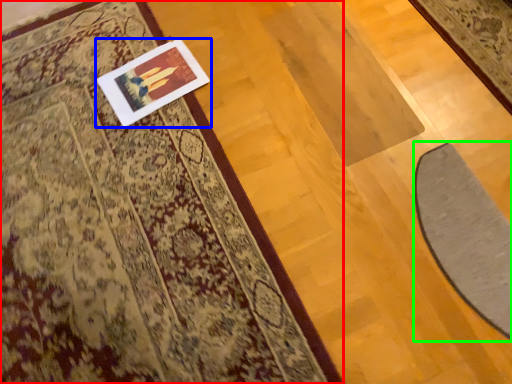
Question: Estimate the real-world distances between objects in this image. Which object is farther from mat (highlighted by a red box), picture frame (highlighted by a blue box) or doormat (highlighted by a green box)?

Choices:
 (A) picture frame
 (B) doormat

Answer: (B)